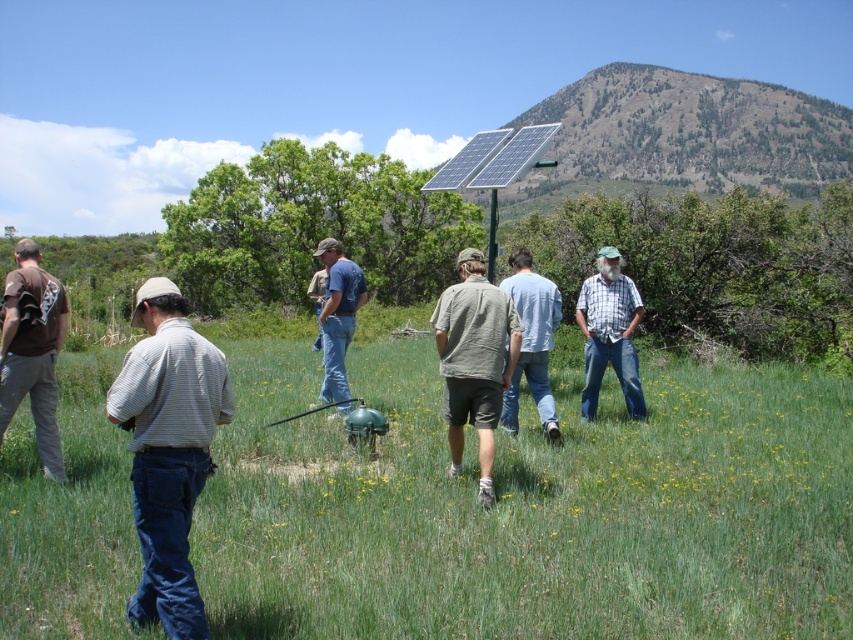
Between point (51, 476) and point (520, 365), which one is positioned in front?

Point (51, 476) is in front.

Is matte brown shirt at left positioned in front of light blue cotton shirt at center?

Yes, it is in front of light blue cotton shirt at center.

Where is `matte brown shirt at left`? matte brown shirt at left is located at coordinates (32, 349).

Looking at this image, does matte brown shirt at left have a larger size compared to blue plaid shirt at center?

Yes, matte brown shirt at left is bigger than blue plaid shirt at center.

Is point (35, 422) positioned before point (619, 308)?

Yes.

Find the location of `matte brown shirt at left`. matte brown shirt at left is located at coordinates (32, 349).

Locate an element on the screen. This screenshot has height=640, width=853. matte brown shirt at left is located at coordinates (32, 349).

Does white striped shirt at left have a smaller size compared to light brown cotton shirt at center?

Incorrect, white striped shirt at left is not smaller in size than light brown cotton shirt at center.

Based on the photo, is white striped shirt at left to the right of light brown cotton shirt at center from the viewer's perspective?

Incorrect, white striped shirt at left is not on the right side of light brown cotton shirt at center.

Does point (148, 444) come behind point (488, 406)?

No, it is in front of (488, 406).

The width and height of the screenshot is (853, 640). I want to click on white striped shirt at left, so click(167, 449).